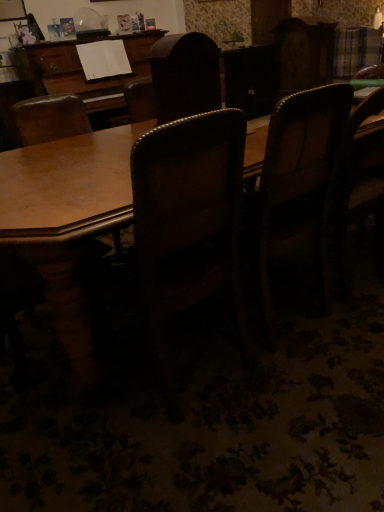
Locate an element on the screen. The image size is (384, 512). wooden table at center is located at coordinates (67, 218).

You are a GUI agent. You are given a task and a screenshot of the screen. Output one action in this format:
    pyautogui.click(x=<x>, y=<y>)
    Task: Click on the dark wood chair at right, the second chair positioned from the right
    The image size is (384, 512).
    Given the screenshot: What is the action you would take?
    pyautogui.click(x=297, y=182)

This screenshot has width=384, height=512. I want to click on wooden chair at right, the 1th chair viewed from the right, so click(x=360, y=182).

This screenshot has width=384, height=512. What do you see at coordinates (185, 76) in the screenshot?
I see `dark wood chair at center, which appears as the 3th chair when viewed from the right` at bounding box center [185, 76].

At what (x,y) coordinates should I click in order to perform the action: click on wooden table at center. Please return your answer as a coordinate pair (x, y). The height and width of the screenshot is (512, 384). Looking at the image, I should click on (67, 218).

Which object is positioned more to the right, wooden chair at right, the 1th chair viewed from the right, or wooden table at center?

Positioned to the right is wooden chair at right, the 1th chair viewed from the right.

Between wooden chair at right, marked as the 4th chair in a left-to-right arrangement, and wooden table at center, which one has smaller width?

wooden chair at right, marked as the 4th chair in a left-to-right arrangement.

Identify the location of table below the wooden chair at right, marked as the 4th chair in a left-to-right arrangement (from the image's perspective). (67, 218).

Are wooden chair at right, marked as the 4th chair in a left-to-right arrangement, and wooden table at center beside each other?

wooden chair at right, marked as the 4th chair in a left-to-right arrangement, and wooden table at center are clearly separated.

Do you think wooden table at center is within dark wood chair at center, which appears as the 3th chair when viewed from the right, or outside of it?

wooden table at center is not enclosed by dark wood chair at center, which appears as the 3th chair when viewed from the right.

How distant is wooden table at center from dark wood chair at center, which ranks as the 2th chair in left-to-right order?

wooden table at center and dark wood chair at center, which ranks as the 2th chair in left-to-right order, are 18.74 inches apart.

Does wooden table at center touch dark wood chair at center, which ranks as the 2th chair in left-to-right order?

wooden table at center and dark wood chair at center, which ranks as the 2th chair in left-to-right order, are clearly separated.

You are a GUI agent. You are given a task and a screenshot of the screen. Output one action in this format:
    pyautogui.click(x=<x>, y=<y>)
    Task: Click on the table on the right of dark wood chair at center, which ranks as the 2th chair in left-to-right order
    
    Given the screenshot: What is the action you would take?
    pyautogui.click(x=67, y=218)

From the image's perspective, which is above, wooden chair at right, marked as the 4th chair in a left-to-right arrangement, or dark wood chair at right, positioned as the third chair in left-to-right order?

wooden chair at right, marked as the 4th chair in a left-to-right arrangement.

Consider the image. Which object is positioned more to the right, wooden chair at right, marked as the 4th chair in a left-to-right arrangement, or dark wood chair at right, the second chair positioned from the right?

From the viewer's perspective, wooden chair at right, marked as the 4th chair in a left-to-right arrangement, appears more on the right side.

Considering the relative sizes of wooden chair at right, the 1th chair viewed from the right, and dark wood chair at right, positioned as the third chair in left-to-right order, in the image provided, is wooden chair at right, the 1th chair viewed from the right, thinner than dark wood chair at right, positioned as the third chair in left-to-right order,?

Yes.

Based on their sizes in the image, would you say wooden chair at right, marked as the 4th chair in a left-to-right arrangement, is bigger or smaller than dark wood chair at right, the second chair positioned from the right?

Clearly, wooden chair at right, marked as the 4th chair in a left-to-right arrangement, is smaller in size than dark wood chair at right, the second chair positioned from the right.

Who is taller, dark wood chair at right, positioned as the third chair in left-to-right order, or dark wood chair at center, which ranks as the 2th chair in left-to-right order?

dark wood chair at right, positioned as the third chair in left-to-right order.

Measure the distance from dark wood chair at right, positioned as the third chair in left-to-right order, to dark wood chair at center, which appears as the 3th chair when viewed from the right.

The distance of dark wood chair at right, positioned as the third chair in left-to-right order, from dark wood chair at center, which appears as the 3th chair when viewed from the right, is 56.69 centimeters.

Is dark wood chair at right, positioned as the third chair in left-to-right order, at the left side of dark wood chair at center, which appears as the 3th chair when viewed from the right?

No.

Is dark wood chair at right, positioned as the third chair in left-to-right order, situated inside dark wood chair at center, which ranks as the 2th chair in left-to-right order, or outside?

dark wood chair at right, positioned as the third chair in left-to-right order, is located beyond the bounds of dark wood chair at center, which ranks as the 2th chair in left-to-right order.

Is wooden chair at center, the fourth chair in the right-to-left sequence, surrounding dark wood chair at center, which ranks as the 2th chair in left-to-right order?

Actually, dark wood chair at center, which ranks as the 2th chair in left-to-right order, is outside wooden chair at center, the fourth chair in the right-to-left sequence.

Is wooden chair at center, the fourth chair in the right-to-left sequence, oriented towards dark wood chair at center, which appears as the 3th chair when viewed from the right?

No, wooden chair at center, the fourth chair in the right-to-left sequence, is not oriented towards dark wood chair at center, which appears as the 3th chair when viewed from the right.

Which of these two, wooden chair at center, the first chair positioned from the left, or dark wood chair at center, which appears as the 3th chair when viewed from the right, stands taller?

wooden chair at center, the first chair positioned from the left, is taller.

From the image's perspective, which one is positioned lower, wooden chair at center, the first chair positioned from the left, or dark wood chair at center, which appears as the 3th chair when viewed from the right?

wooden chair at center, the first chair positioned from the left.

In terms of height, does wooden chair at right, marked as the 4th chair in a left-to-right arrangement, look taller or shorter compared to dark wood chair at center, which ranks as the 2th chair in left-to-right order?

Clearly, wooden chair at right, marked as the 4th chair in a left-to-right arrangement, is taller compared to dark wood chair at center, which ranks as the 2th chair in left-to-right order.

From the image's perspective, is wooden chair at right, marked as the 4th chair in a left-to-right arrangement, below dark wood chair at center, which ranks as the 2th chair in left-to-right order?

Indeed, from the image's perspective, wooden chair at right, marked as the 4th chair in a left-to-right arrangement, is shown beneath dark wood chair at center, which ranks as the 2th chair in left-to-right order.

Considering the relative positions of wooden chair at right, marked as the 4th chair in a left-to-right arrangement, and dark wood chair at center, which ranks as the 2th chair in left-to-right order, in the image provided, is wooden chair at right, marked as the 4th chair in a left-to-right arrangement, behind dark wood chair at center, which ranks as the 2th chair in left-to-right order,?

That is True.

Could you measure the distance between wooden chair at right, the 1th chair viewed from the right, and dark wood chair at center, which appears as the 3th chair when viewed from the right?

wooden chair at right, the 1th chair viewed from the right, is 26.99 inches from dark wood chair at center, which appears as the 3th chair when viewed from the right.

Is wooden table at center at the left side of dark wood chair at right, the second chair positioned from the right?

Yes.

Based on the photo, from a real-world perspective, relative to dark wood chair at right, the second chair positioned from the right, is wooden table at center vertically above or below?

In terms of real-world spatial position, wooden table at center is below dark wood chair at right, the second chair positioned from the right.

Locate an element on the screen. The height and width of the screenshot is (512, 384). table on the left of dark wood chair at right, the second chair positioned from the right is located at coordinates (67, 218).

Image resolution: width=384 pixels, height=512 pixels. I want to click on chair that is the 1st object above the wooden table at center (from a real-world perspective), so click(360, 182).

Locate an element on the screen. The image size is (384, 512). the 2nd chair behind the wooden table at center is located at coordinates (185, 76).

Considering their positions, is dark wood chair at right, the second chair positioned from the right, positioned closer to wooden chair at center, the fourth chair in the right-to-left sequence, than dark wood chair at center, which appears as the 3th chair when viewed from the right?

dark wood chair at center, which appears as the 3th chair when viewed from the right.

Based on their spatial positions, is dark wood chair at center, which ranks as the 2th chair in left-to-right order, or wooden table at center further from wooden chair at center, the fourth chair in the right-to-left sequence?

wooden table at center is positioned further to the anchor wooden chair at center, the fourth chair in the right-to-left sequence.

When comparing their distances from wooden chair at center, the fourth chair in the right-to-left sequence, does dark wood chair at right, positioned as the third chair in left-to-right order, or wooden chair at right, the 1th chair viewed from the right, seem further?

wooden chair at right, the 1th chair viewed from the right, lies further to wooden chair at center, the fourth chair in the right-to-left sequence, than the other object.

From the image, which object appears to be farther from dark wood chair at center, which ranks as the 2th chair in left-to-right order, wooden chair at center, the first chair positioned from the left, or wooden chair at right, the 1th chair viewed from the right?

Based on the image, wooden chair at right, the 1th chair viewed from the right, appears to be further to dark wood chair at center, which ranks as the 2th chair in left-to-right order.

From the image, which object appears to be farther from wooden chair at center, the fourth chair in the right-to-left sequence, dark wood chair at center, which ranks as the 2th chair in left-to-right order, or wooden chair at right, the 1th chair viewed from the right?

wooden chair at right, the 1th chair viewed from the right, lies further to wooden chair at center, the fourth chair in the right-to-left sequence, than the other object.

Estimate the real-world distances between objects in this image. Which object is further from dark wood chair at right, the second chair positioned from the right, dark wood chair at center, which appears as the 3th chair when viewed from the right, or wooden chair at right, the 1th chair viewed from the right?

The object further to dark wood chair at right, the second chair positioned from the right, is dark wood chair at center, which appears as the 3th chair when viewed from the right.

Which object lies nearer to the anchor point wooden chair at center, the fourth chair in the right-to-left sequence, wooden table at center or wooden chair at right, the 1th chair viewed from the right?

Based on the image, wooden table at center appears to be nearer to wooden chair at center, the fourth chair in the right-to-left sequence.

When comparing their distances from dark wood chair at center, which appears as the 3th chair when viewed from the right, does dark wood chair at right, the second chair positioned from the right, or wooden chair at right, marked as the 4th chair in a left-to-right arrangement, seem further?

wooden chair at right, marked as the 4th chair in a left-to-right arrangement, is positioned further to the anchor dark wood chair at center, which appears as the 3th chair when viewed from the right.

Identify the location of chair between wooden chair at center, the fourth chair in the right-to-left sequence, and wooden table at center. The height and width of the screenshot is (512, 384). click(185, 76).

The image size is (384, 512). Identify the location of chair between dark wood chair at center, which appears as the 3th chair when viewed from the right, and wooden chair at right, the 1th chair viewed from the right. (297, 182).

This screenshot has width=384, height=512. Identify the location of table located between wooden chair at center, the first chair positioned from the left, and wooden chair at right, the 1th chair viewed from the right, in the left-right direction. (67, 218).

Image resolution: width=384 pixels, height=512 pixels. Identify the location of table situated between dark wood chair at center, which appears as the 3th chair when viewed from the right, and dark wood chair at right, positioned as the third chair in left-to-right order, from left to right. (67, 218).